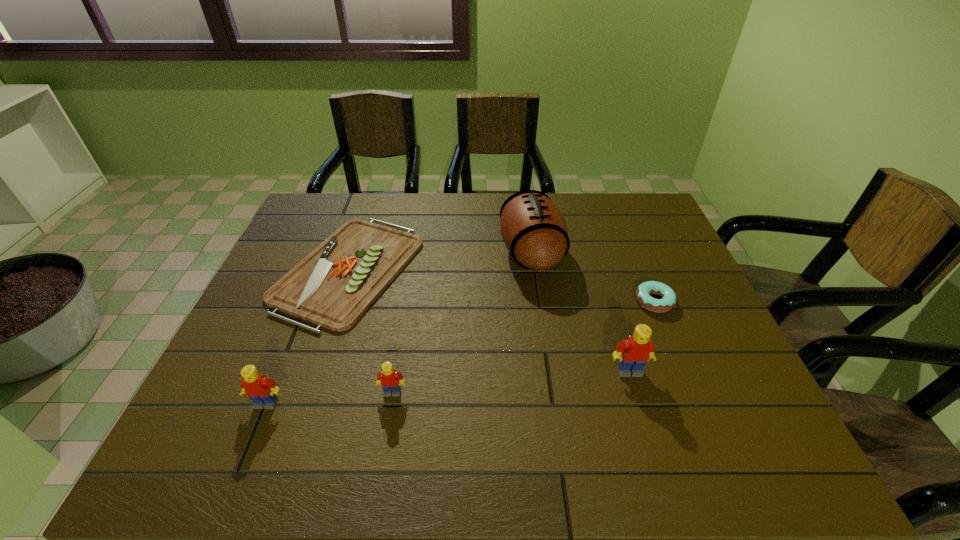
Locate an element on the screen. This screenshot has height=540, width=960. vacant point located between the nearest Lego and the rightmost Lego is located at coordinates (447, 387).

This screenshot has width=960, height=540. I want to click on vacant area between the chopping board and the third shortest object, so tap(371, 331).

The height and width of the screenshot is (540, 960). What are the coordinates of `empty space that is in between the doughnut and the football (American)` in the screenshot? It's located at (592, 276).

Find the location of a particular element. The image size is (960, 540). vacant space that is in between the chopping board and the nearest object is located at coordinates (308, 336).

Image resolution: width=960 pixels, height=540 pixels. Find the location of `object that is the fourth closest to the doughnut`. object that is the fourth closest to the doughnut is located at coordinates (391, 381).

Where is `the second closest object to the football (American)`? The width and height of the screenshot is (960, 540). the second closest object to the football (American) is located at coordinates (333, 286).

The image size is (960, 540). I want to click on Lego object that ranks as the closest to the tallest Lego, so click(x=391, y=381).

Where is `the second closest Lego to the doughnut`? the second closest Lego to the doughnut is located at coordinates (391, 381).